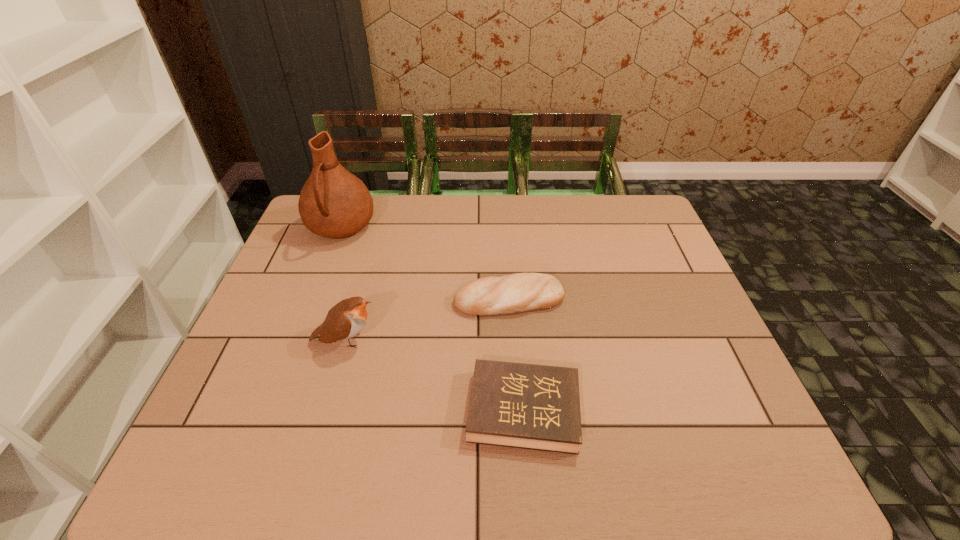
At what (x,y) coordinates should I click in order to perform the action: click on vacant space that satisfies the following two spatial constraints: 1. on the side of the farthest object with the handle; 2. on the right side of the hardback book. Please return your answer as a coordinate pair (x, y). Image resolution: width=960 pixels, height=540 pixels. Looking at the image, I should click on (272, 410).

I want to click on free space that satisfies the following two spatial constraints: 1. on the side of the third tallest object with the handle; 2. on the right side of the tallest object, so click(314, 299).

Identify the location of vacant space that satisfies the following two spatial constraints: 1. on the side of the pitcher with the handle; 2. on the right side of the bread. (314, 299).